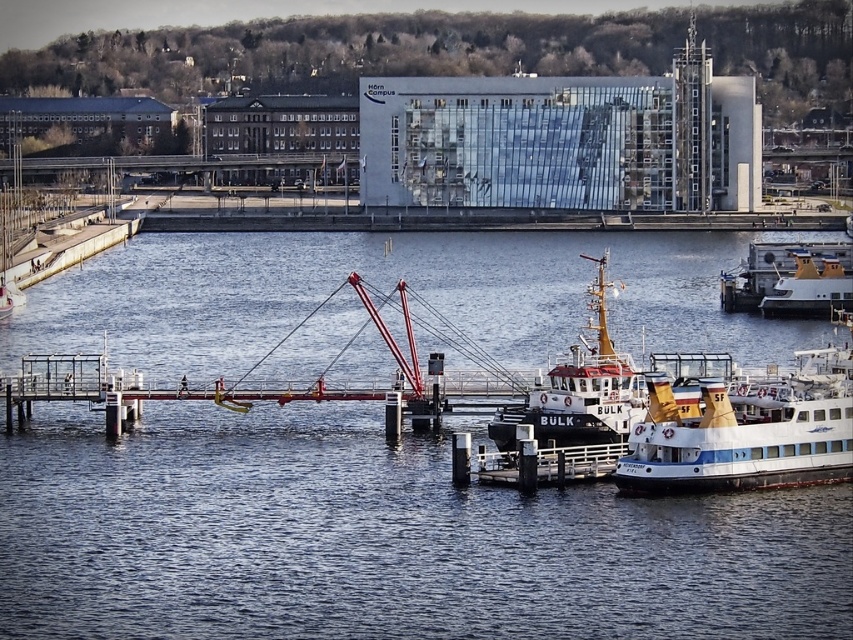
Question: Is blue water at center wider than yellow matte boat at center?

Choices:
 (A) yes
 (B) no

Answer: (A)

Question: In this image, where is blue water at center located relative to white glossy boat at center?

Choices:
 (A) right
 (B) left

Answer: (B)

Question: Among these objects, which one is nearest to the camera?

Choices:
 (A) blue water at center
 (B) yellow matte boat at center
 (C) white glossy boat at center

Answer: (A)

Question: Is yellow matte boat at center positioned in front of white glossy boat at center?

Choices:
 (A) no
 (B) yes

Answer: (B)

Question: Estimate the real-world distances between objects in this image. Which object is farther from the yellow matte boat at center?

Choices:
 (A) blue water at center
 (B) white glossy boat at center

Answer: (B)

Question: Which point appears farthest from the camera in this image?

Choices:
 (A) (45, 307)
 (B) (845, 244)

Answer: (B)